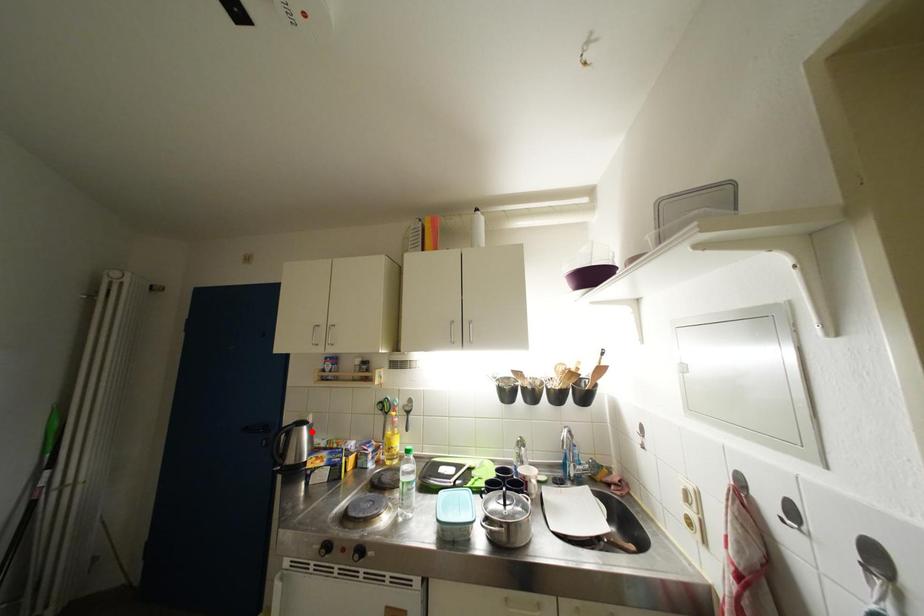
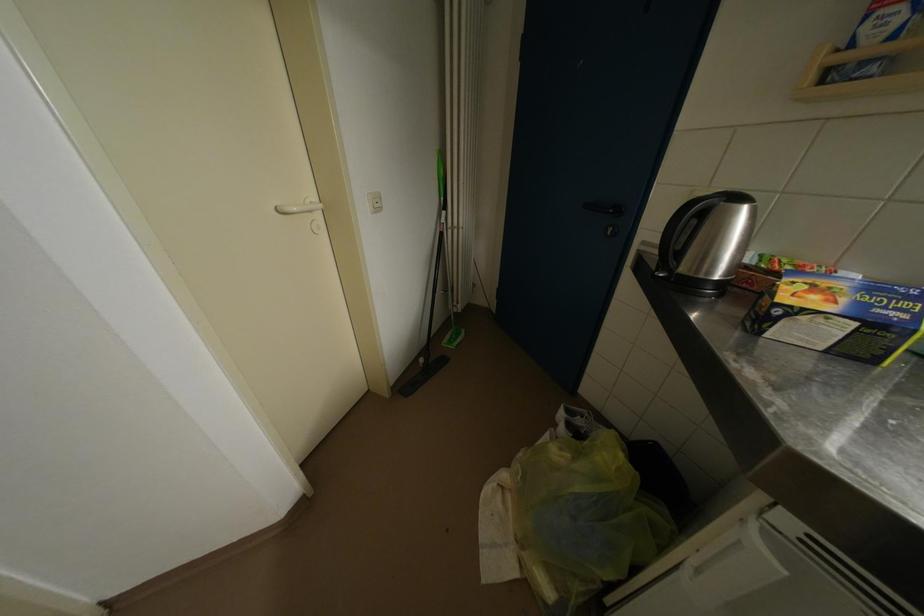
Where in the second image is the point corresponding to the highlighted location from the first image?

(752, 213)